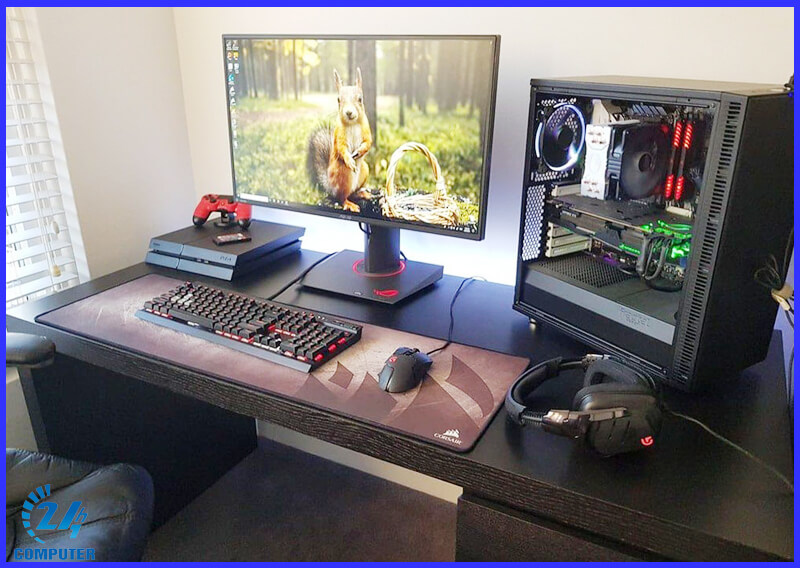
Where is `wall`? This screenshot has width=800, height=568. wall is located at coordinates (194, 31).